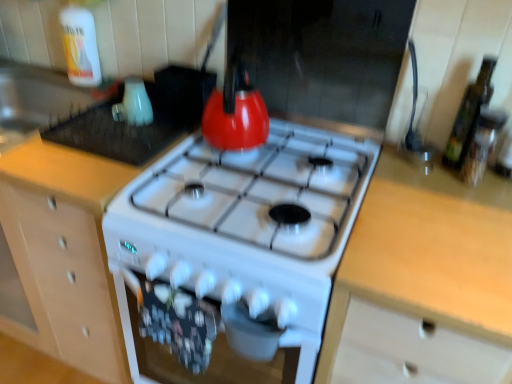
Identify the location of free space to the left of green glass bottle at right, the 1th bottle viewed from the right. (398, 177).